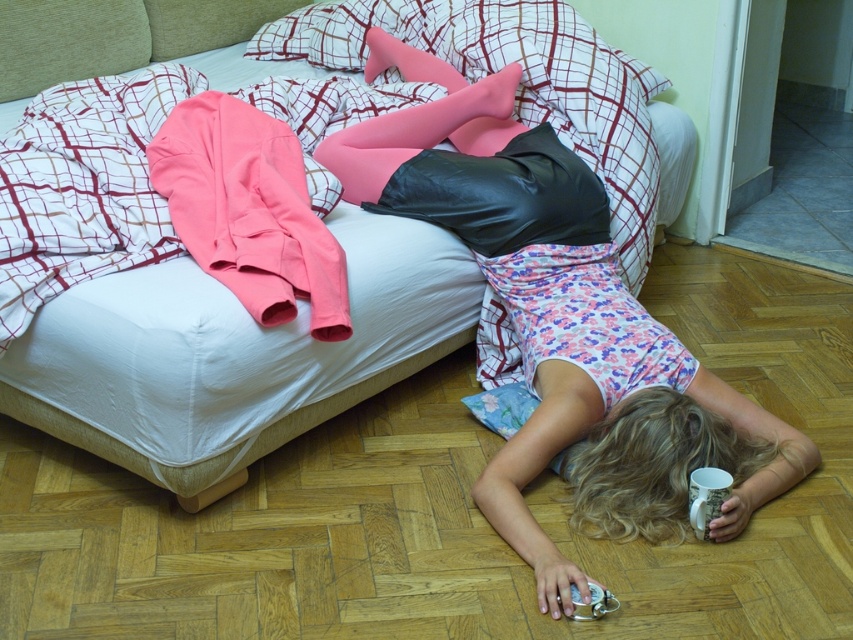
Question: Which object is the closest to the pink fabric jacket at upper left?

Choices:
 (A) floral cotton dress at lower center
 (B) white cotton bed at upper center

Answer: (B)

Question: Which of the following is the closest to the observer?

Choices:
 (A) (505, 228)
 (B) (265, 308)
 (C) (419, 364)

Answer: (B)

Question: Is floral cotton dress at lower center to the left of white cotton bed at upper center from the viewer's perspective?

Choices:
 (A) no
 (B) yes

Answer: (A)

Question: Can you confirm if floral cotton dress at lower center is thinner than white cotton bed at upper center?

Choices:
 (A) yes
 (B) no

Answer: (B)

Question: Which object appears closest to the camera in this image?

Choices:
 (A) floral cotton dress at lower center
 (B) white cotton bed at upper center

Answer: (A)

Question: Is white cotton bed at upper center positioned at the back of pink fabric jacket at upper left?

Choices:
 (A) yes
 (B) no

Answer: (B)